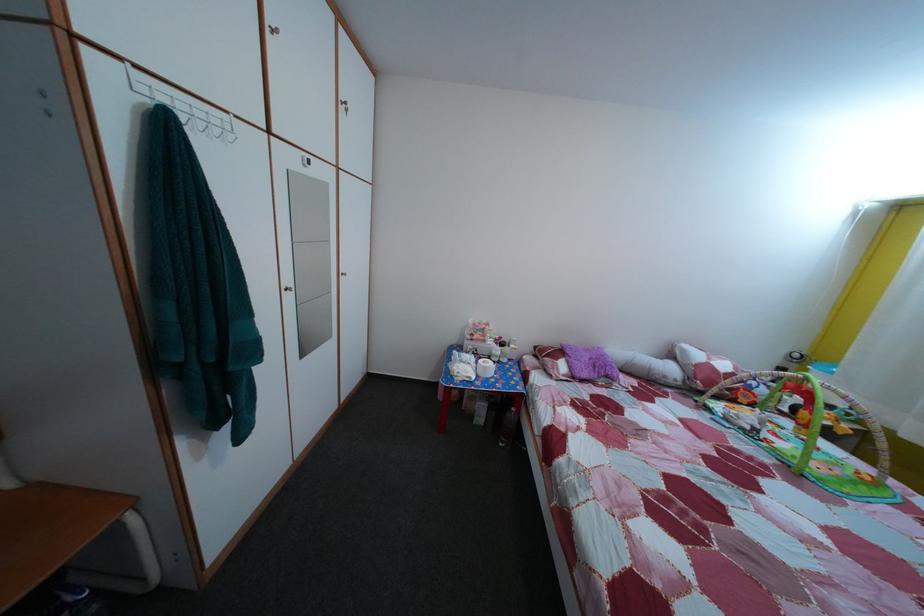
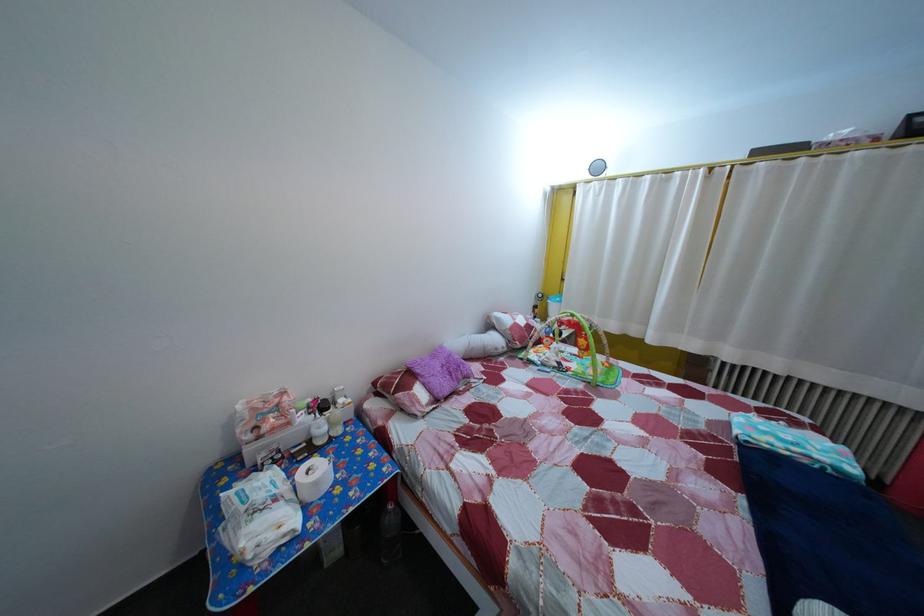
In the second image, find the point that corresponds to the point at 500,350 in the first image.

(311, 427)